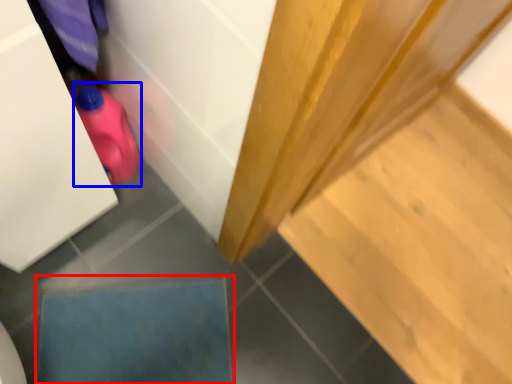
Question: Which point is closer to the camera, square (highlighted by a red box) or stuff (highlighted by a blue box)?

Choices:
 (A) square
 (B) stuff

Answer: (B)